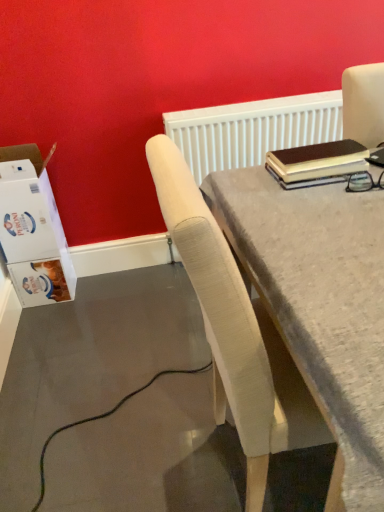
Question: Is white textured radiator at upper center beside white cardboard box at left?

Choices:
 (A) yes
 (B) no

Answer: (B)

Question: Is white textured radiator at upper center shorter than white cardboard box at left?

Choices:
 (A) yes
 (B) no

Answer: (A)

Question: Could you tell me if white textured radiator at upper center is turned towards white cardboard box at left?

Choices:
 (A) no
 (B) yes

Answer: (A)

Question: Can you confirm if white textured radiator at upper center is wider than white cardboard box at left?

Choices:
 (A) no
 (B) yes

Answer: (A)

Question: Is white textured radiator at upper center bigger than white cardboard box at left?

Choices:
 (A) no
 (B) yes

Answer: (A)

Question: Is white textured radiator at upper center located outside white cardboard box at left?

Choices:
 (A) yes
 (B) no

Answer: (A)

Question: Is white cardboard box at left behind white textured radiator at upper center?

Choices:
 (A) yes
 (B) no

Answer: (B)

Question: Is white cardboard box at left far from white textured radiator at upper center?

Choices:
 (A) yes
 (B) no

Answer: (B)

Question: Is white cardboard box at left facing away from white textured radiator at upper center?

Choices:
 (A) yes
 (B) no

Answer: (B)

Question: From the image's perspective, does white cardboard box at left appear lower than white textured radiator at upper center?

Choices:
 (A) yes
 (B) no

Answer: (A)

Question: Is the position of white cardboard box at left less distant than that of white textured radiator at upper center?

Choices:
 (A) no
 (B) yes

Answer: (B)

Question: Is white cardboard box at left aimed at white textured radiator at upper center?

Choices:
 (A) no
 (B) yes

Answer: (B)

Question: Does white textured radiator at upper center lie behind light beige fabric chair at center?

Choices:
 (A) yes
 (B) no

Answer: (A)